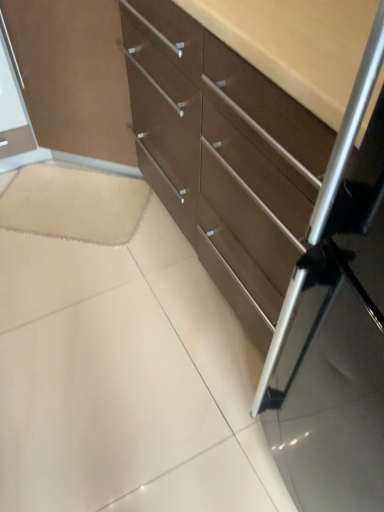
Question: From their relative heights in the image, would you say beige soft carpet at lower left is taller or shorter than matte brown chest of drawers at center?

Choices:
 (A) short
 (B) tall

Answer: (A)

Question: Considering the positions of point (64, 221) and point (145, 5), is point (64, 221) closer or farther from the camera than point (145, 5)?

Choices:
 (A) farther
 (B) closer

Answer: (A)

Question: From a real-world perspective, is beige soft carpet at lower left physically located above or below matte brown chest of drawers at center?

Choices:
 (A) below
 (B) above

Answer: (A)

Question: Is point (148, 67) positioned closer to the camera than point (102, 203)?

Choices:
 (A) farther
 (B) closer

Answer: (B)

Question: In terms of height, does matte brown chest of drawers at center look taller or shorter compared to beige soft carpet at lower left?

Choices:
 (A) short
 (B) tall

Answer: (B)

Question: Considering the relative positions of matte brown chest of drawers at center and beige soft carpet at lower left in the image provided, is matte brown chest of drawers at center to the left or to the right of beige soft carpet at lower left?

Choices:
 (A) right
 (B) left

Answer: (A)

Question: Is matte brown chest of drawers at center wider or thinner than beige soft carpet at lower left?

Choices:
 (A) thin
 (B) wide

Answer: (B)